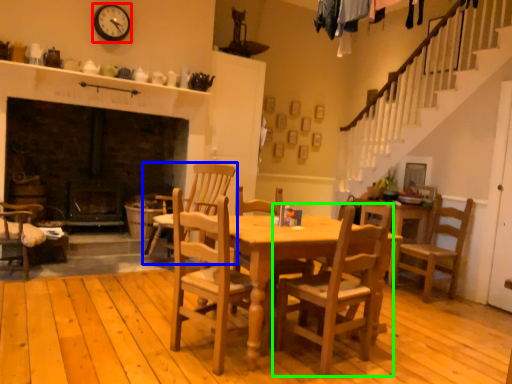
Question: Estimate the real-world distances between objects in this image. Which object is farther from clock (highlighted by a red box), chair (highlighted by a blue box) or chair (highlighted by a green box)?

Choices:
 (A) chair
 (B) chair

Answer: (B)